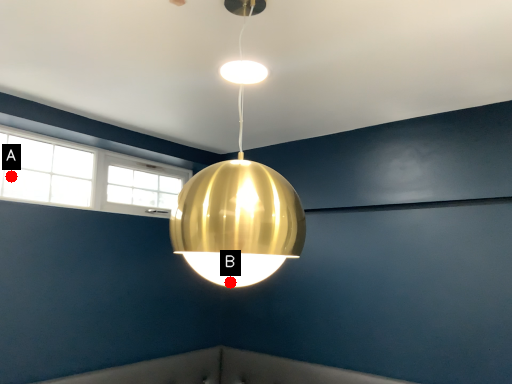
Question: Two points are circled on the image, labeled by A and B beside each circle. Which point appears farthest from the camera in this image?

Choices:
 (A) A is further
 (B) B is further

Answer: (A)